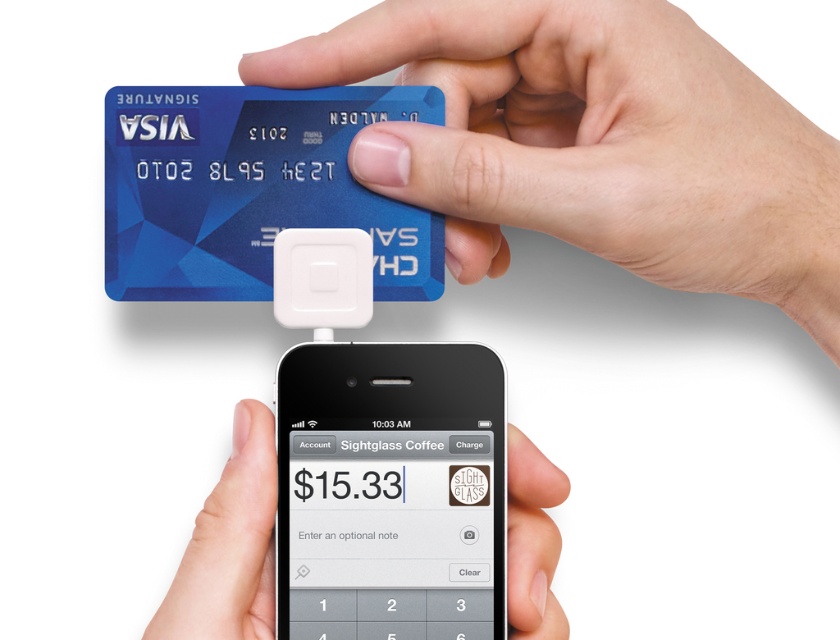
Does blue plastic credit card at upper center appear on the right side of blue plastic card at upper center?

Indeed, blue plastic credit card at upper center is positioned on the right side of blue plastic card at upper center.

How far apart are blue plastic credit card at upper center and blue plastic card at upper center?

blue plastic credit card at upper center and blue plastic card at upper center are 6.72 centimeters apart from each other.

Locate an element on the screen. This screenshot has height=640, width=840. blue plastic credit card at upper center is located at coordinates pos(592,144).

Is black plastic phone at center below white matte phone at lower center?

Actually, black plastic phone at center is above white matte phone at lower center.

Measure the distance from black plastic phone at center to white matte phone at lower center.

black plastic phone at center is 2.37 centimeters from white matte phone at lower center.

Does point (300, 481) lie behind point (207, 570)?

Yes.

Locate an element on the screen. This screenshot has height=640, width=840. black plastic phone at center is located at coordinates (390, 492).

Which is below, blue plastic credit card at upper center or black plastic phone at center?

black plastic phone at center is below.

Is point (570, 61) positioned after point (316, 529)?

Yes, point (570, 61) is behind point (316, 529).

You are a GUI agent. You are given a task and a screenshot of the screen. Output one action in this format:
    pyautogui.click(x=<x>, y=<y>)
    Task: Click on the blue plastic credit card at upper center
    This screenshot has width=840, height=640.
    Given the screenshot: What is the action you would take?
    pyautogui.click(x=592, y=144)